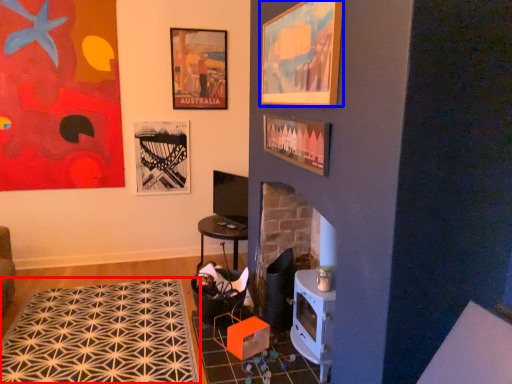
Question: Among these objects, which one is nearest to the camera, mat (highlighted by a red box) or picture frame (highlighted by a blue box)?

Choices:
 (A) mat
 (B) picture frame

Answer: (B)